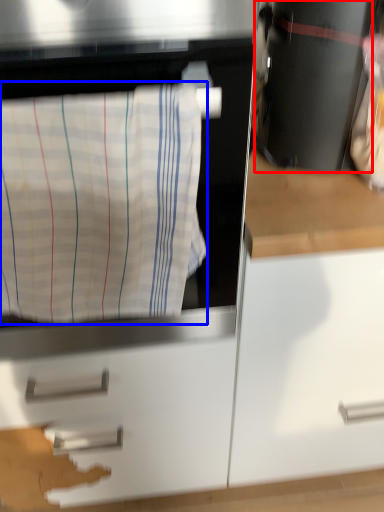
Question: Among these objects, which one is nearest to the camera, appliance (highlighted by a red box) or laundry (highlighted by a blue box)?

Choices:
 (A) appliance
 (B) laundry

Answer: (B)